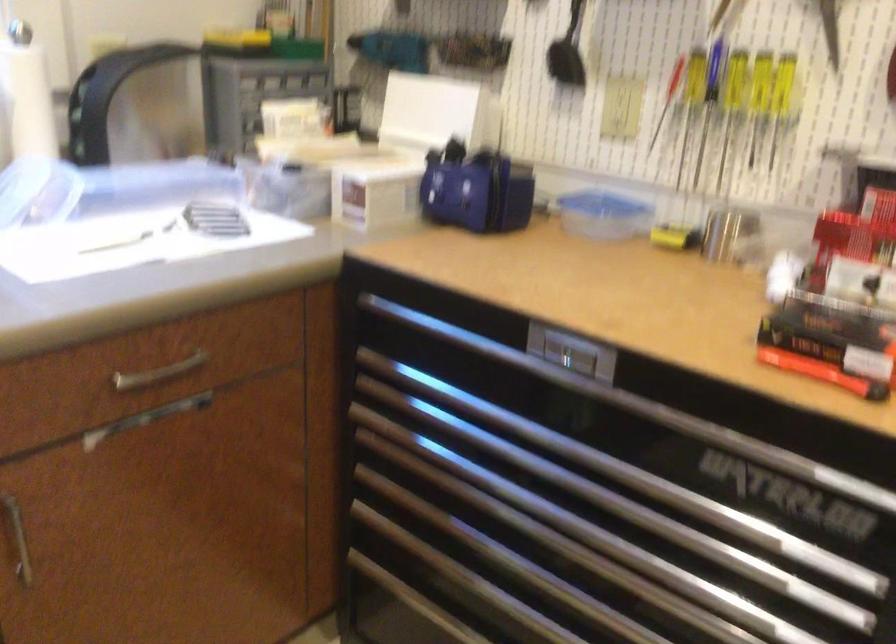
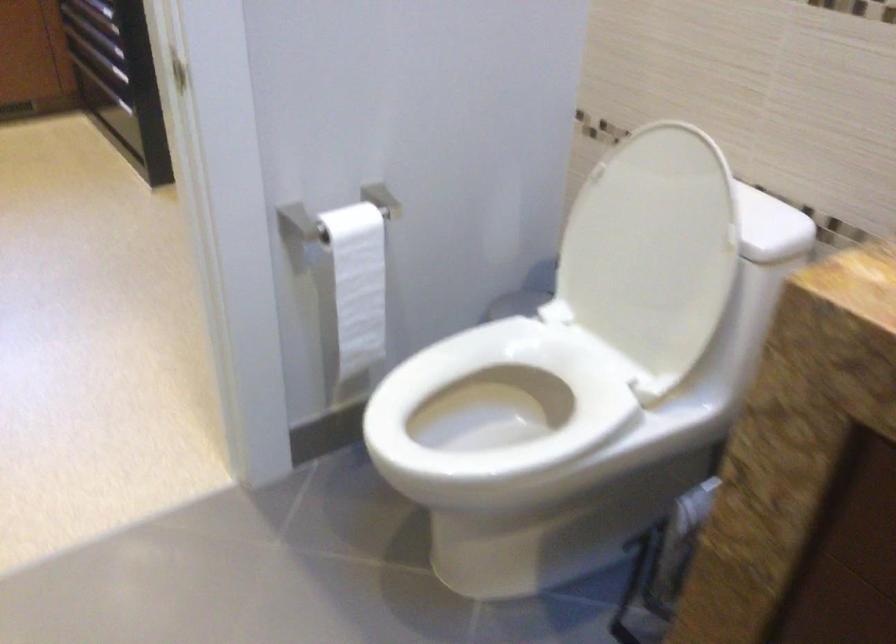
Which direction would the cameraman need to move to produce the second image?

The movement direction of the cameraman is right, backward.